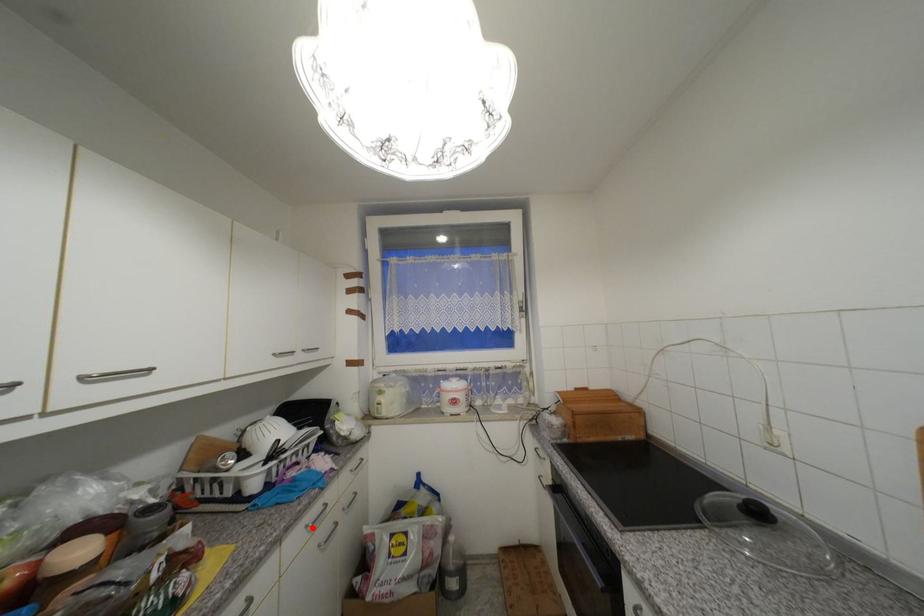
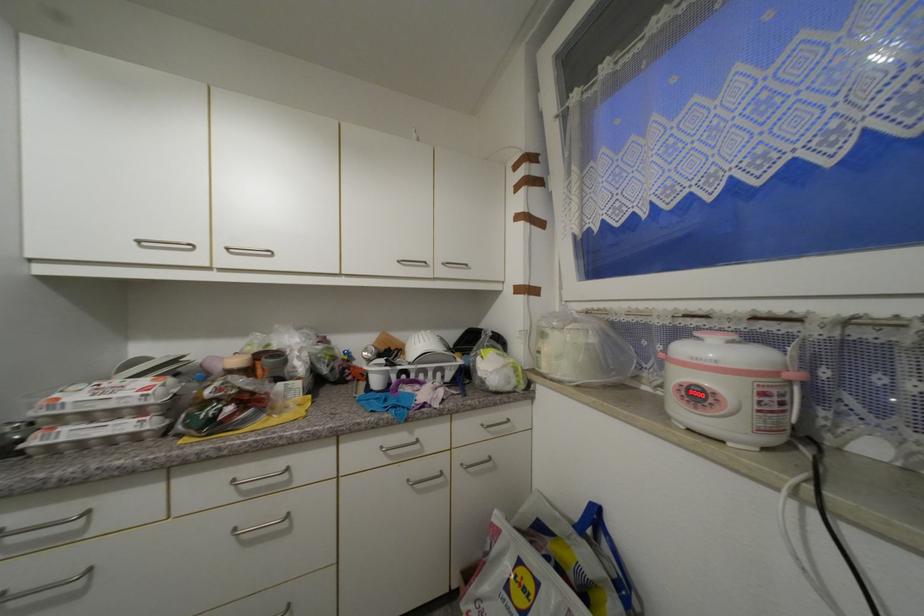
Locate, in the second image, the point that corresponds to the highlighted location in the first image.

(387, 448)